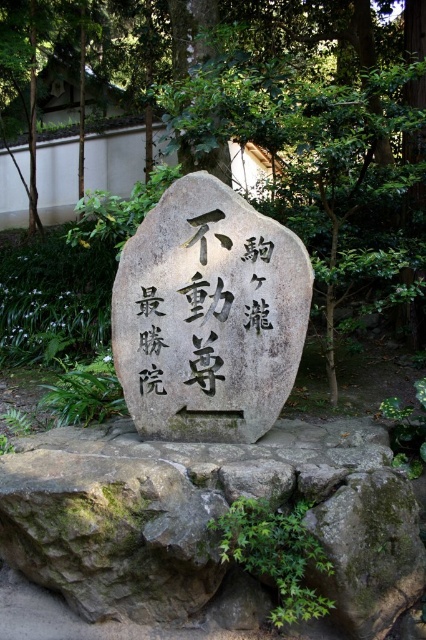
You are a gardener who wants to water the green leafy tree at center and the black stone writing at center. You have a watering can with a 24 inch long hose. Can you water both objects without moving the watering can? Explain your reasoning.

The green leafy tree at center is 25.21 inches away from the black stone writing at center. Since the hose is only 24 inches long, it is too short to reach both objects simultaneously. You would need to move the watering can to reach one or the other.

Based on the photo, you are a gardener tasked with trimming plants around the black stone writing at center. You notice the green leafy tree at center is obstructing your view of the stone. Can you determine if the tree is larger than the writing?

The green leafy tree at center is bigger than black stone writing at center, so yes, the tree is larger and could be obstructing the view of the writing.

You are a gardener who needs to water both the green leafy tree at center and the gray rough stone at center. Your watering can has a range of 4 feet. Without moving the can, can you water both objects from your current position?

The distance between the green leafy tree at center and the gray rough stone at center is 3.98 feet, which is within the 4 feet range of the watering can. Therefore, you can water both objects without moving the can.